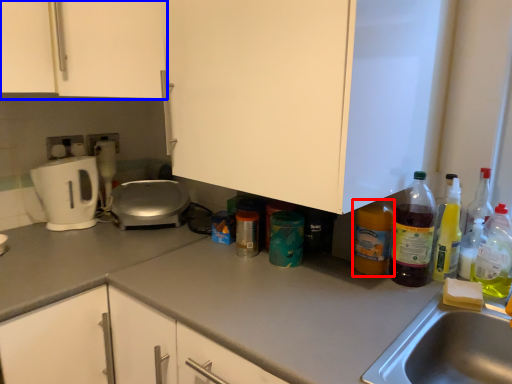
Question: Which point is further to the camera, bottle (highlighted by a red box) or cabinetry (highlighted by a blue box)?

Choices:
 (A) bottle
 (B) cabinetry

Answer: (B)